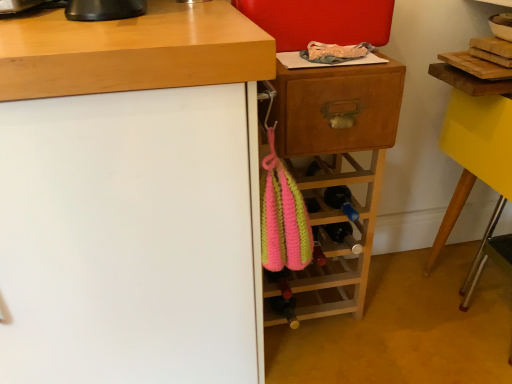
Question: Is white matte cabinet at left touching yellow glossy table at right?

Choices:
 (A) no
 (B) yes

Answer: (A)

Question: Does white matte cabinet at left have a smaller size compared to yellow glossy table at right?

Choices:
 (A) yes
 (B) no

Answer: (B)

Question: Can you confirm if white matte cabinet at left is thinner than yellow glossy table at right?

Choices:
 (A) no
 (B) yes

Answer: (A)

Question: Is white matte cabinet at left positioned in front of yellow glossy table at right?

Choices:
 (A) yes
 (B) no

Answer: (A)

Question: Is white matte cabinet at left turned away from yellow glossy table at right?

Choices:
 (A) yes
 (B) no

Answer: (B)

Question: Considering the positions of yellow glossy table at right and white matte cabinet at left in the image, is yellow glossy table at right wider or thinner than white matte cabinet at left?

Choices:
 (A) thin
 (B) wide

Answer: (A)

Question: Visually, is yellow glossy table at right positioned to the left or to the right of white matte cabinet at left?

Choices:
 (A) right
 (B) left

Answer: (A)

Question: Would you say yellow glossy table at right is inside or outside white matte cabinet at left?

Choices:
 (A) outside
 (B) inside

Answer: (A)

Question: In terms of height, does yellow glossy table at right look taller or shorter compared to white matte cabinet at left?

Choices:
 (A) short
 (B) tall

Answer: (A)

Question: Is pink knitted bottle at center taller or shorter than wooden drawer at upper right?

Choices:
 (A) tall
 (B) short

Answer: (B)

Question: From a real-world perspective, is pink knitted bottle at center positioned above or below wooden drawer at upper right?

Choices:
 (A) above
 (B) below

Answer: (B)

Question: Is pink knitted bottle at center spatially inside wooden drawer at upper right, or outside of it?

Choices:
 (A) inside
 (B) outside

Answer: (B)

Question: Looking at their shapes, would you say pink knitted bottle at center is wider or thinner than wooden drawer at upper right?

Choices:
 (A) thin
 (B) wide

Answer: (B)

Question: From a real-world perspective, is pink knitted bag at center positioned above or below yellow glossy table at right?

Choices:
 (A) below
 (B) above

Answer: (A)

Question: Is pink knitted bag at center to the left or to the right of yellow glossy table at right in the image?

Choices:
 (A) right
 (B) left

Answer: (B)